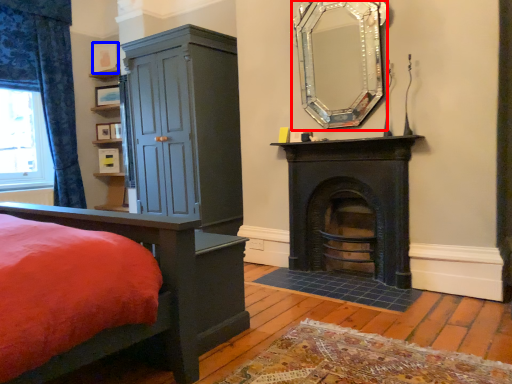
Question: Which of the following is the farthest to the observer, fireplace (highlighted by a red box) or picture frame (highlighted by a blue box)?

Choices:
 (A) fireplace
 (B) picture frame

Answer: (B)